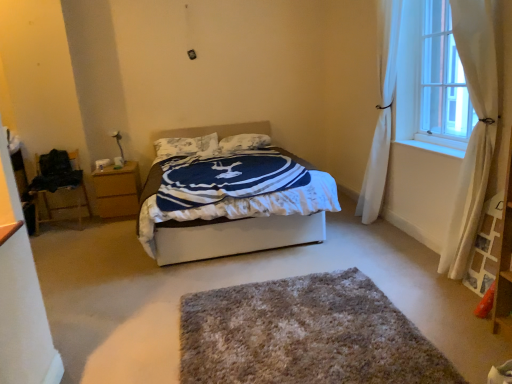
The width and height of the screenshot is (512, 384). Find the location of `vacant space that is to the left of white sheer curtain at right, which is the 1th curtain in back-to-front order`. vacant space that is to the left of white sheer curtain at right, which is the 1th curtain in back-to-front order is located at coordinates (338, 235).